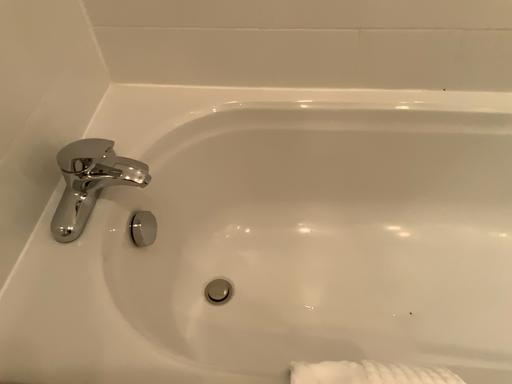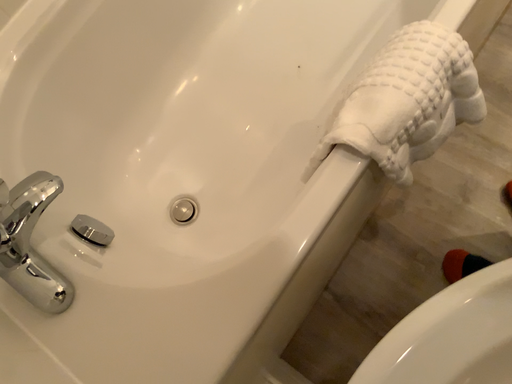
Question: How did the camera likely rotate when shooting the video?

Choices:
 (A) rotated left
 (B) rotated right

Answer: (B)